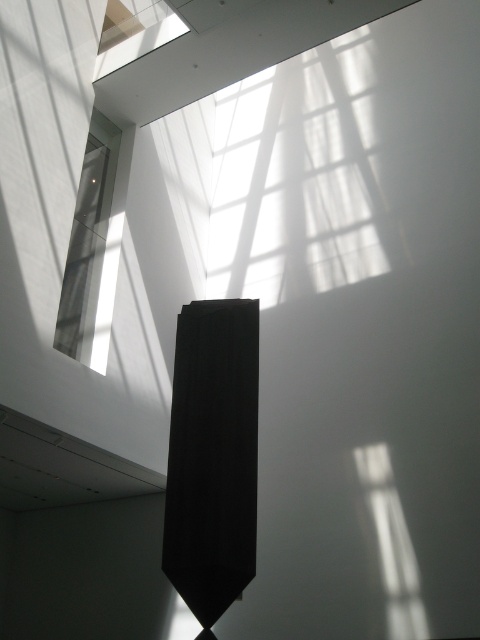
Is matte black tie at center behind clear glass window at upper left?

No, matte black tie at center is in front of clear glass window at upper left.

Between point (178, 417) and point (113, 273), which one is positioned in front?

Point (178, 417) is in front.

Image resolution: width=480 pixels, height=640 pixels. I want to click on matte black tie at center, so click(x=213, y=456).